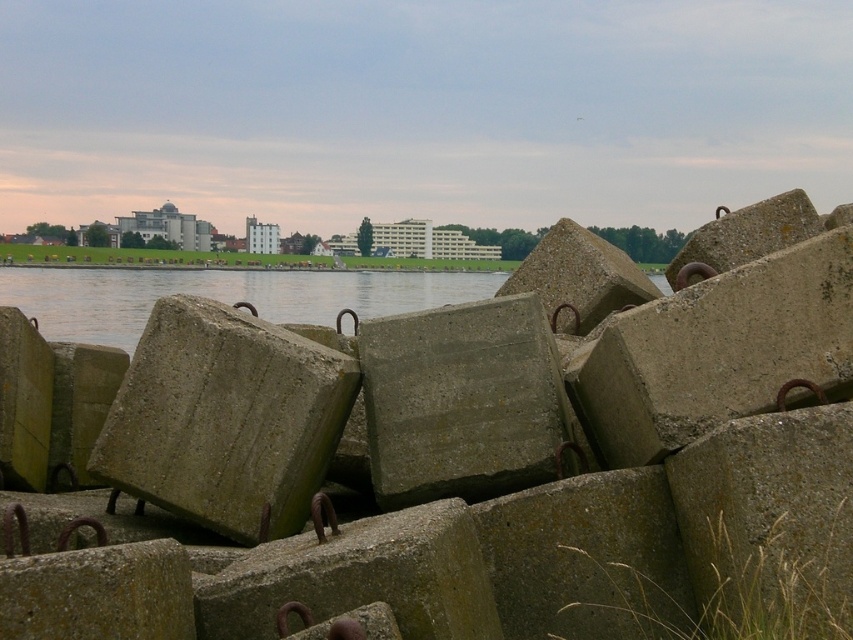
You are standing at the edge of the water in the scene. You see two points marked on the ground. The first point is at coordinate point (804, 365) and the second is at point (242, 333). Which point is closer to you?

Point (804, 365) is closer to the camera than point (242, 333), so the first point is closer to you.